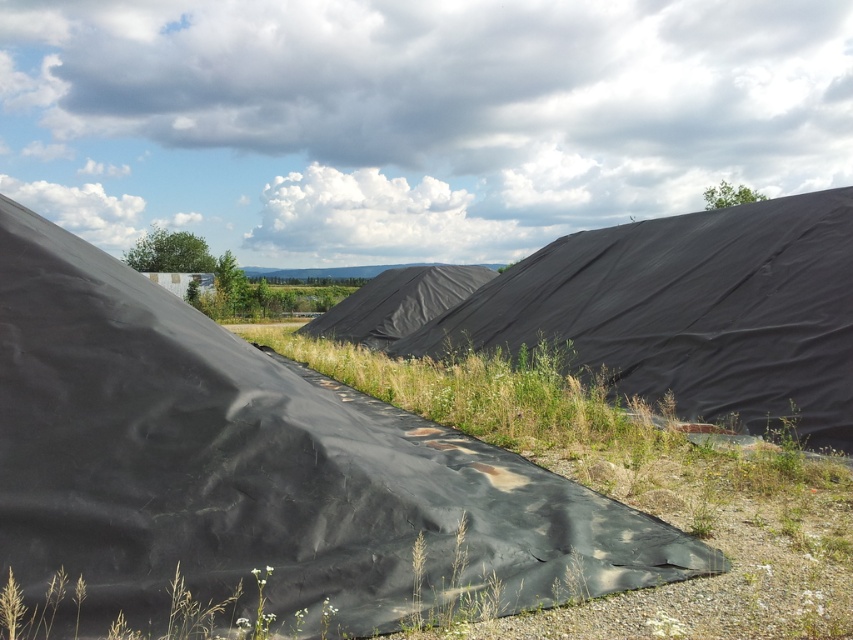
You are a waste management worker standing at the edge of the landfill. You need to place a new waste container between the black matte tarp at center and the black tarp at center. Which tarp should you place it closer to if you want the container to be as far as possible from the uncovered soil area in the foreground?

You should place the new waste container closer to the black matte tarp at center because it is closer to the viewer than the black tarp at center, so positioning it near the black matte tarp would keep it farther away from the uncovered soil area in the foreground.

You are a landscape worker trying to mow the green matte grass at center and the black tarp at center. Which one is taller and needs to be cut first?

The black tarp at center is taller than the green matte grass at center, so you should cut the green matte grass at center first before addressing the black tarp at center.

You are a maintenance worker at the landfill. You need to determine which area is larger between the black matte tarp at center and the green matte grass at center. Which one occupies more space?

The green matte grass at center occupies more space than the black matte tarp at center because the black matte tarp at center occupies less space than green matte grass at center.